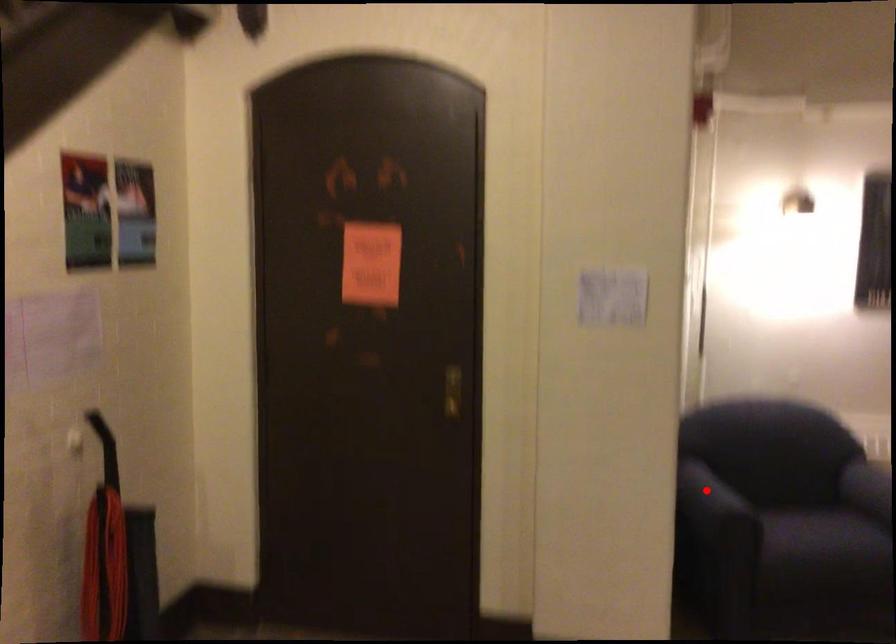
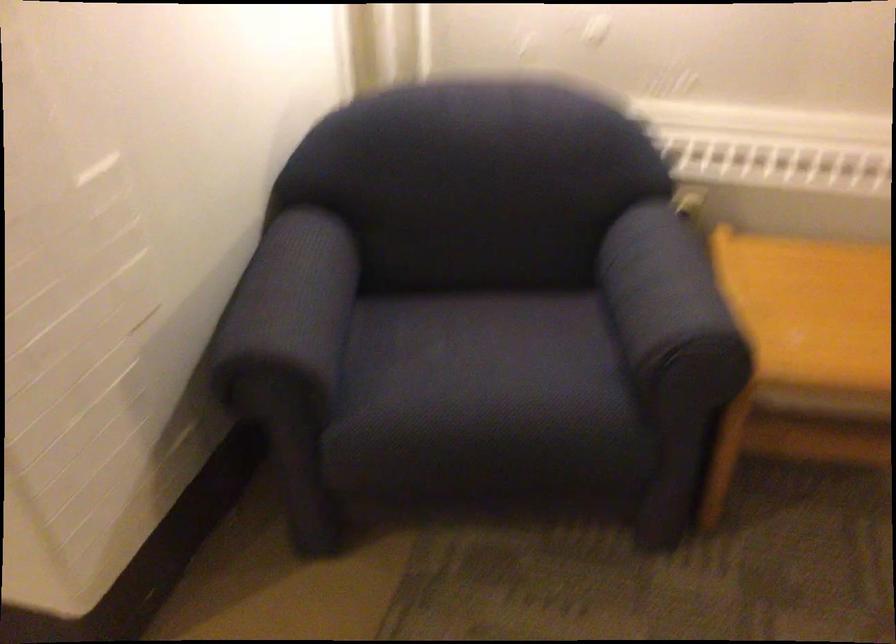
In the second image, find the point that corresponds to the highlighted location in the first image.

(289, 307)